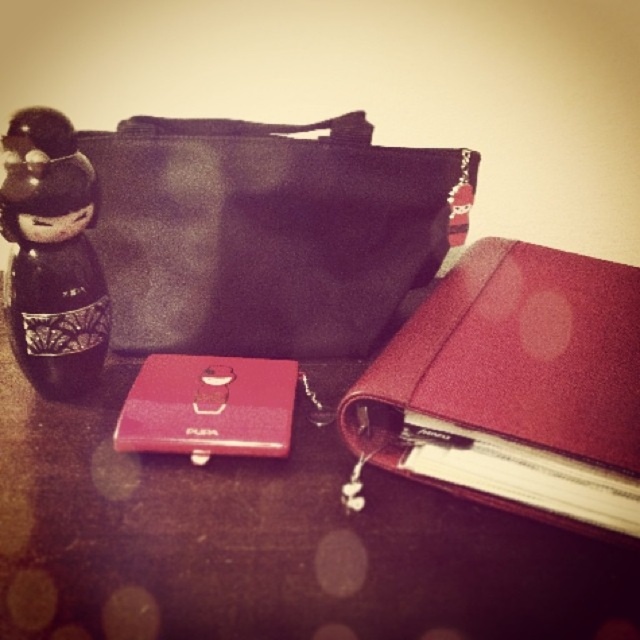
You are organizing items on a dark surface and need to place the satin burgundy binder at center. Where should you place it relative to the small figurine resembling a traditional Japanese Kokeshi doll on the left side?

The satin burgundy binder at center should be placed at point [515,387] relative to the small figurine resembling a traditional Japanese Kokeshi doll on the left side.

You are organizing items on a desk and need to place the black fabric bag at upper left and the satin burgundy binder at center. Based on their positions, which item is closer to the top edge of the desk?

The black fabric bag at upper left is closer to the top edge of the desk because it is located above the satin burgundy binder at center.